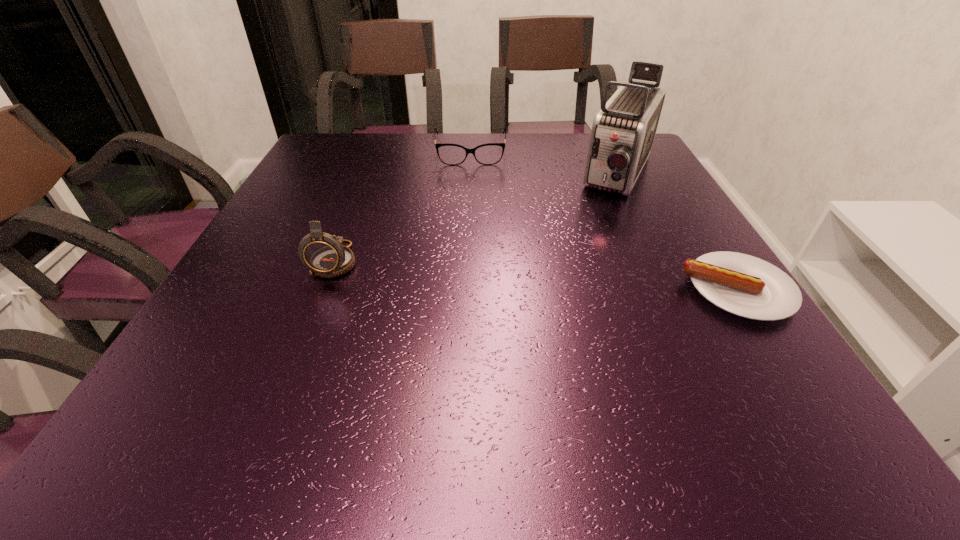
Locate an element on the screen. This screenshot has width=960, height=540. vacant space located on the front-facing side of the third object from right to left is located at coordinates (470, 211).

Where is `vacant space situated 0.250m at the lens of the camcorder`? vacant space situated 0.250m at the lens of the camcorder is located at coordinates (582, 265).

At what (x,y) coordinates should I click in order to perform the action: click on vacant area situated at the lens of the camcorder. Please return your answer as a coordinate pair (x, y). The width and height of the screenshot is (960, 540). Looking at the image, I should click on (560, 305).

At what (x,y) coordinates should I click in order to perform the action: click on vacant space located at the lens of the camcorder. Please return your answer as a coordinate pair (x, y). Image resolution: width=960 pixels, height=540 pixels. Looking at the image, I should click on (609, 216).

The height and width of the screenshot is (540, 960). Identify the location of spectacles positioned at the far edge. (450, 154).

Where is `camcorder located at the far edge`? The image size is (960, 540). camcorder located at the far edge is located at coordinates (623, 131).

Where is `object situated at the left edge`? This screenshot has height=540, width=960. object situated at the left edge is located at coordinates (324, 254).

What are the coordinates of `sausage located in the right edge section of the desktop` in the screenshot? It's located at (747, 286).

Locate an element on the screen. The image size is (960, 540). camcorder present at the right edge is located at coordinates (623, 131).

Identify the location of object located at the far right corner. (623, 131).